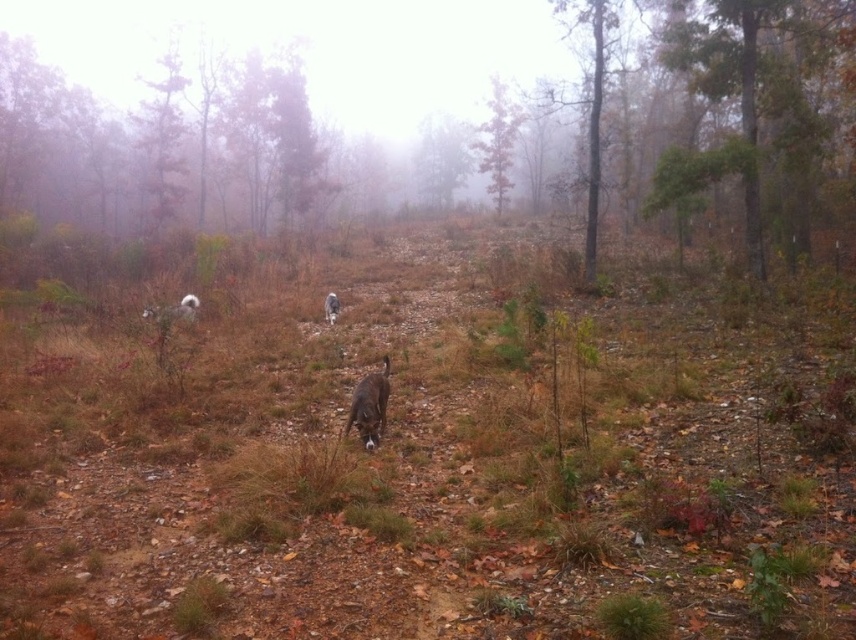
Question: Can you confirm if green matte tree at upper left is positioned below gray fur dog at center?

Choices:
 (A) yes
 (B) no

Answer: (B)

Question: Can you confirm if green textured tree at right is smaller than white fur dog at center?

Choices:
 (A) no
 (B) yes

Answer: (A)

Question: Can you confirm if green matte tree at upper left is positioned to the right of green leafy tree at center?

Choices:
 (A) yes
 (B) no

Answer: (B)

Question: Which object appears closest to the camera in this image?

Choices:
 (A) green textured tree at right
 (B) green leafy tree at center

Answer: (A)

Question: Which point is farther to the camera?

Choices:
 (A) green matte tree at upper center
 (B) smooth brown tree trunk at upper left
 (C) white fluffy dog at left
 (D) green leafy tree at center

Answer: (A)

Question: Which object is positioned farthest from the gray fur dog at center?

Choices:
 (A) green textured tree at right
 (B) white fluffy dog at left
 (C) green matte tree at upper center
 (D) white fur dog at center

Answer: (C)